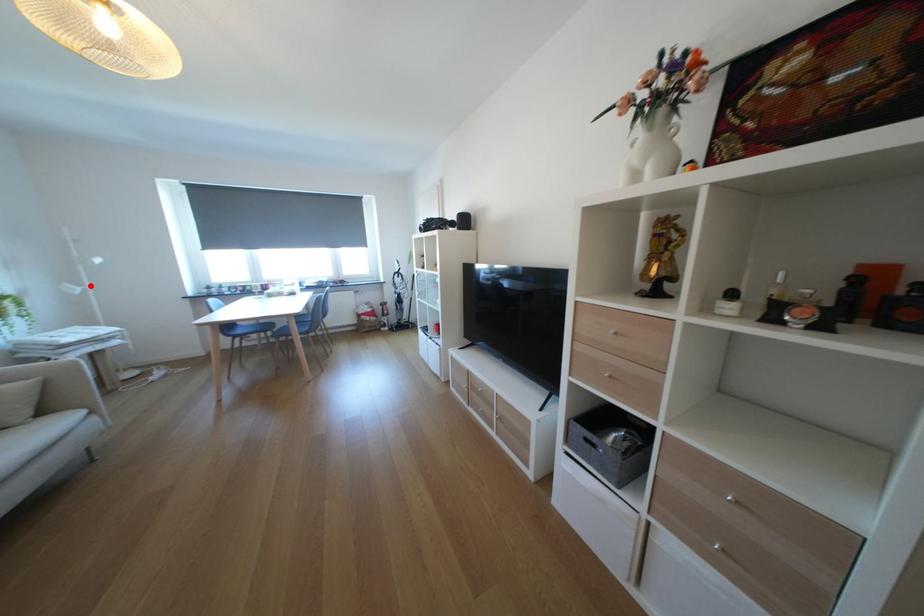
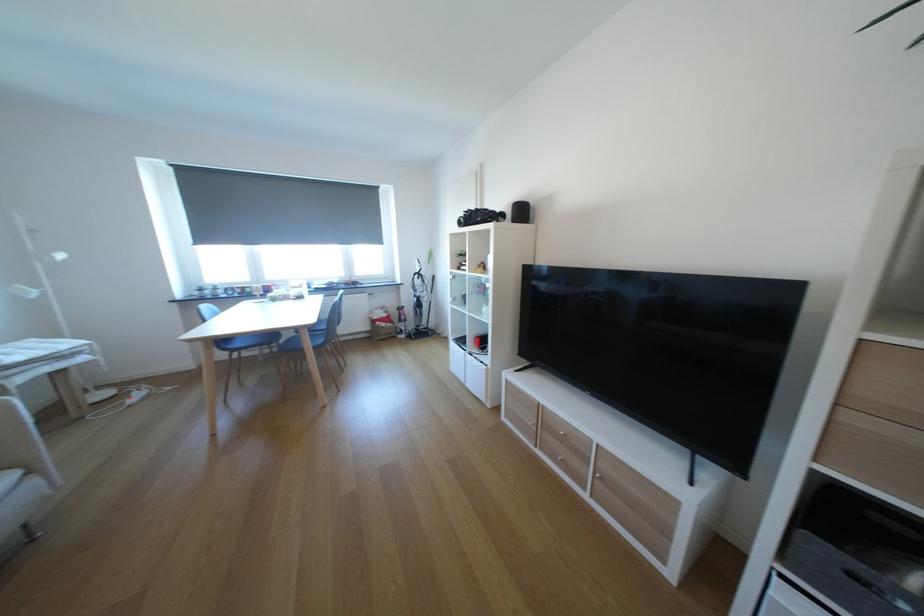
Locate, in the second image, the point that corresponds to the highlighted location in the first image.

(47, 286)